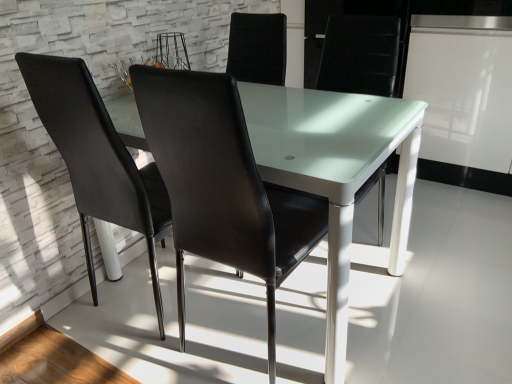
Question: Is black leather chair at center, which appears as the 1th chair when viewed from the right, wider than transparent glass table at center?

Choices:
 (A) yes
 (B) no

Answer: (B)

Question: Does black leather chair at center, which appears as the 1th chair when viewed from the right, appear on the left side of transparent glass table at center?

Choices:
 (A) yes
 (B) no

Answer: (B)

Question: Is black leather chair at center, which appears as the 1th chair when viewed from the right, shorter than transparent glass table at center?

Choices:
 (A) no
 (B) yes

Answer: (A)

Question: Does black leather chair at center, acting as the 2th chair starting from the left, have a lesser width compared to transparent glass table at center?

Choices:
 (A) no
 (B) yes

Answer: (B)

Question: From the image's perspective, is black leather chair at center, which appears as the 1th chair when viewed from the right, below transparent glass table at center?

Choices:
 (A) yes
 (B) no

Answer: (A)

Question: Is black leather chair at left, positioned as the first chair in left-to-right order, to the left or to the right of black leather chair at center, which appears as the 1th chair when viewed from the right, in the image?

Choices:
 (A) right
 (B) left

Answer: (B)

Question: Relative to black leather chair at center, which appears as the 1th chair when viewed from the right, is black leather chair at left, positioned as the first chair in left-to-right order, in front or behind?

Choices:
 (A) front
 (B) behind

Answer: (B)

Question: Considering the positions of black leather chair at left, positioned as the first chair in left-to-right order, and black leather chair at center, acting as the 2th chair starting from the left, in the image, is black leather chair at left, positioned as the first chair in left-to-right order, bigger or smaller than black leather chair at center, acting as the 2th chair starting from the left,?

Choices:
 (A) small
 (B) big

Answer: (A)

Question: In terms of height, does black leather chair at left, placed as the second chair when sorted from right to left, look taller or shorter compared to black leather chair at center, acting as the 2th chair starting from the left?

Choices:
 (A) short
 (B) tall

Answer: (A)

Question: Does point (199, 187) appear closer or farther from the camera than point (126, 221)?

Choices:
 (A) closer
 (B) farther

Answer: (A)

Question: From a real-world perspective, is black leather chair at center, which appears as the 1th chair when viewed from the right, physically located above or below black leather chair at left, positioned as the first chair in left-to-right order?

Choices:
 (A) above
 (B) below

Answer: (A)

Question: Relative to black leather chair at left, positioned as the first chair in left-to-right order, is black leather chair at center, which appears as the 1th chair when viewed from the right, in front or behind?

Choices:
 (A) behind
 (B) front

Answer: (B)

Question: From their relative heights in the image, would you say black leather chair at center, acting as the 2th chair starting from the left, is taller or shorter than black leather chair at left, placed as the second chair when sorted from right to left?

Choices:
 (A) short
 (B) tall

Answer: (B)

Question: Considering the positions of point (290, 87) and point (305, 248), is point (290, 87) closer or farther from the camera than point (305, 248)?

Choices:
 (A) closer
 (B) farther

Answer: (B)

Question: In terms of height, does transparent glass table at center look taller or shorter compared to black leather chair at center, which appears as the 1th chair when viewed from the right?

Choices:
 (A) tall
 (B) short

Answer: (B)